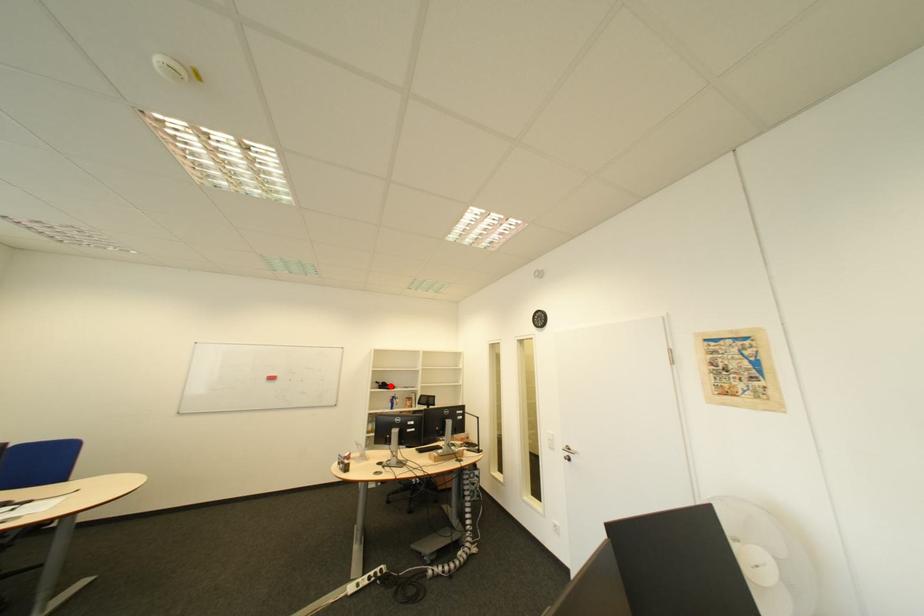
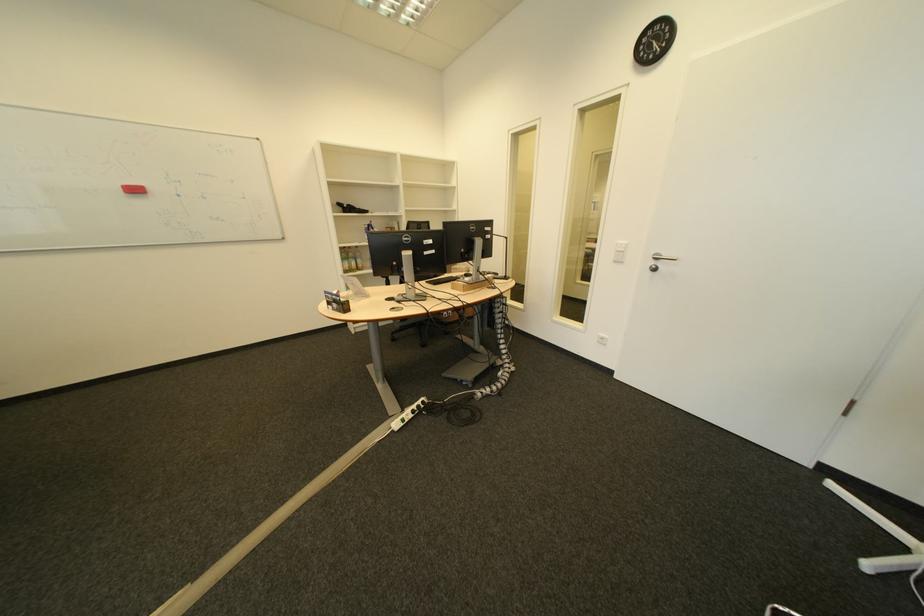
Question: A red point is marked in image1. In image2, is the corresponding 3D point closer to the camera or farther? Reply with the corresponding letter.

Choices:
 (A) The corresponding 3D point is closer.
 (B) The corresponding 3D point is farther.

Answer: (A)